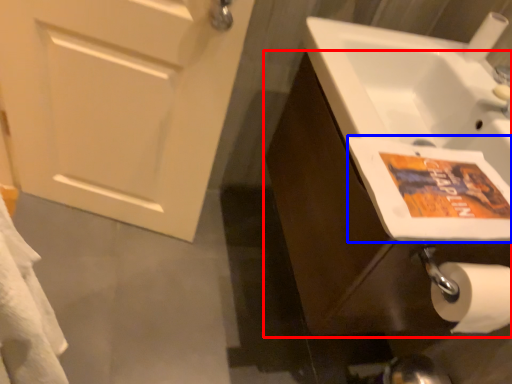
Question: Which object appears closest to the camera in this image, bathroom cabinet (highlighted by a red box) or flyer (highlighted by a blue box)?

Choices:
 (A) bathroom cabinet
 (B) flyer

Answer: (B)